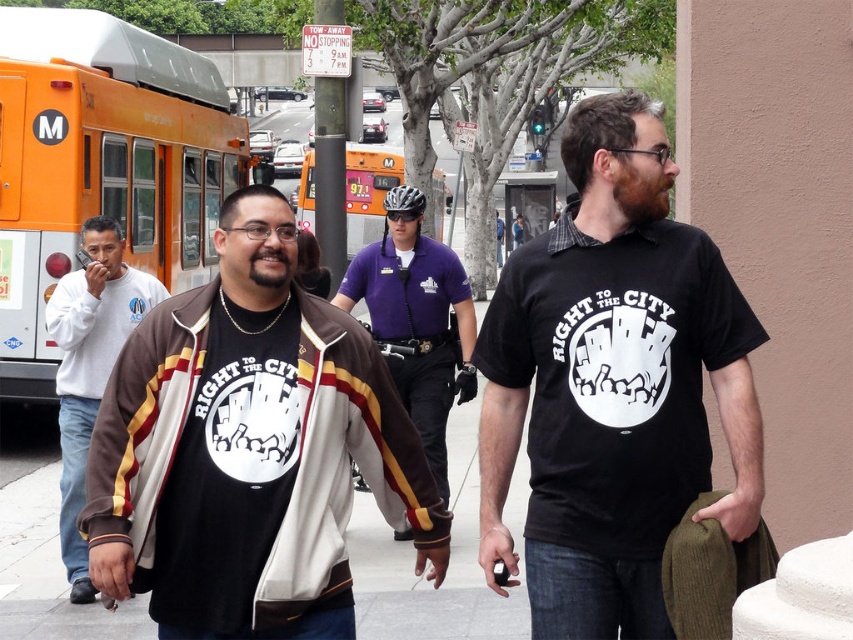
You are standing in the street scene and want to locate the brown suede jacket at center. What are the coordinates where you should look?

The brown suede jacket at center is located at coordinates point [248,449].

You are a pedestrian standing on the sidewalk and see the orange metallic bus at left and the purple uniform shirt at center. Which object is closer to you?

The orange metallic bus at left is smaller than the purple uniform shirt at center, which indicates it is farther away. Therefore, the purple uniform shirt at center is closer to you.

You are a photographer trying to capture a clear shot of both the brown suede jacket at center and the white cotton sweatshirt at left. Since you want both items to be in focus, which one should you focus on first to ensure depth of field covers both?

To ensure both the brown suede jacket at center and the white cotton sweatshirt at left are in focus, you should focus on the brown suede jacket at center first, as it is closer to the viewer. This allows the depth of field to extend backward to include the white cotton sweatshirt at left.